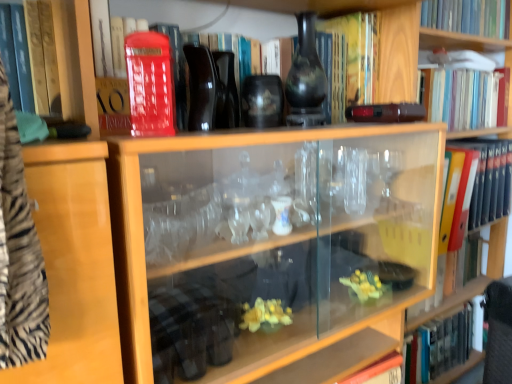
Question: From the image's perspective, is wooden bookshelf at upper right located above or below matte black vase at upper center?

Choices:
 (A) below
 (B) above

Answer: (A)

Question: Is wooden bookshelf at upper right inside the boundaries of matte black vase at upper center, or outside?

Choices:
 (A) outside
 (B) inside

Answer: (A)

Question: Estimate the real-world distances between objects in this image. Which object is farther from the matte red book at upper center, acting as the 4th book starting from the top?

Choices:
 (A) matte red phone box at upper left
 (B) hardcover book at upper right, acting as the fifth book starting from the bottom
 (C) wooden bookshelf at upper right
 (D) matte black vase at upper center
 (E) hardcover book at upper right, the 6th book from the bottom

Answer: (B)

Question: Based on their relative distances, which object is nearer to the matte red book at upper center, acting as the 4th book starting from the top?

Choices:
 (A) wooden bookshelf at upper right
 (B) matte black vase at upper center
 (C) orange file folder at right, which appears as the fifth book when viewed from the top
 (D) matte red phone box at upper left
 (E) yellow matte book at upper center, arranged as the fourth book when ordered from the bottom

Answer: (B)